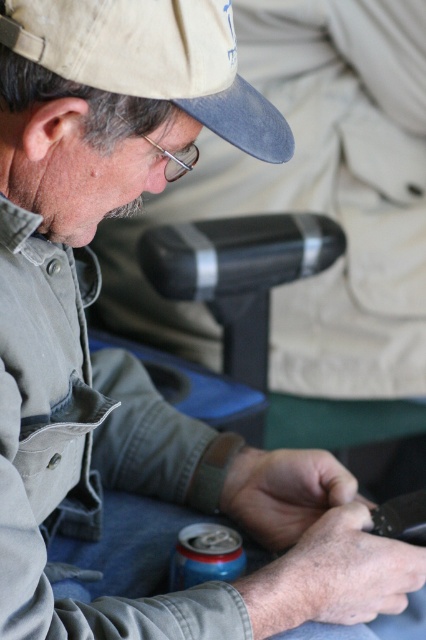
Question: Observing the image, what is the correct spatial positioning of matte khaki cap at upper left in reference to beige fabric cap at upper left?

Choices:
 (A) right
 (B) left

Answer: (A)

Question: Is matte khaki cap at upper left above beige fabric cap at upper left?

Choices:
 (A) no
 (B) yes

Answer: (B)

Question: Among these points, which one is nearest to the camera?

Choices:
 (A) (305, 8)
 (B) (176, 52)

Answer: (B)

Question: Among these objects, which one is nearest to the camera?

Choices:
 (A) matte khaki cap at upper left
 (B) beige fabric cap at upper left

Answer: (B)

Question: Is matte khaki cap at upper left positioned behind beige fabric cap at upper left?

Choices:
 (A) yes
 (B) no

Answer: (A)

Question: Which object appears closest to the camera in this image?

Choices:
 (A) beige fabric cap at upper left
 (B) matte khaki cap at upper left

Answer: (A)